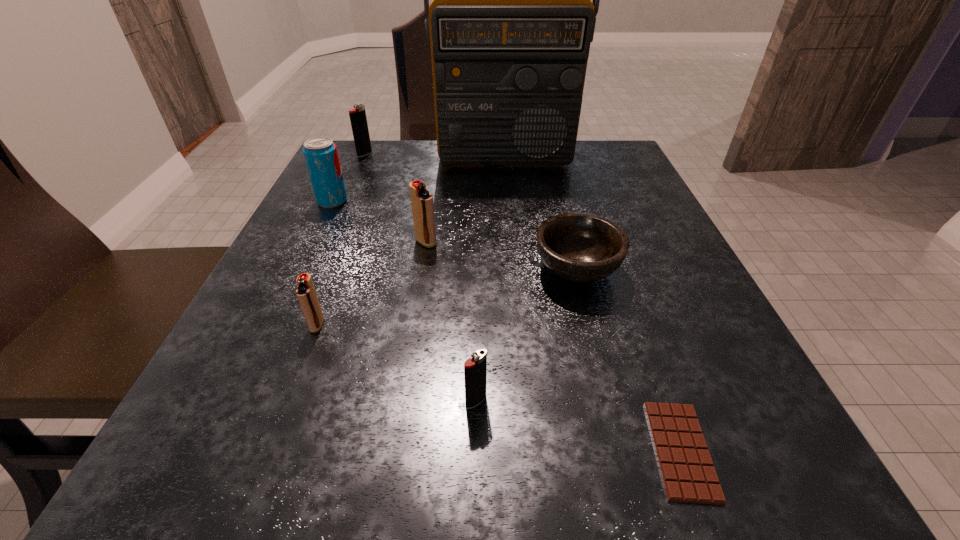
At what (x,y) coordinates should I click in order to perform the action: click on free location located on the left of the second shortest object. Please return your answer as a coordinate pair (x, y). Looking at the image, I should click on (312, 269).

What are the coordinates of `free point located on the left of the brown candy bar` in the screenshot? It's located at (431, 450).

Where is `radio receiver that is positioned at the far edge`? The image size is (960, 540). radio receiver that is positioned at the far edge is located at coordinates (511, 22).

Find the location of a particular element. This screenshot has height=540, width=960. igniter located in the far edge section of the desktop is located at coordinates (358, 119).

I want to click on object located at the near edge, so click(x=688, y=474).

Find the location of a particular element. The width and height of the screenshot is (960, 540). soda can located at the left edge is located at coordinates (320, 153).

You are a GUI agent. You are given a task and a screenshot of the screen. Output one action in this format:
    pyautogui.click(x=<x>, y=<y>)
    Task: Click on the radio receiver located in the right edge section of the desktop
    Image resolution: width=960 pixels, height=540 pixels.
    Given the screenshot: What is the action you would take?
    pyautogui.click(x=511, y=22)

In order to click on bowl present at the right edge in this screenshot , I will do `click(580, 247)`.

Find the location of `candy bar present at the right edge`. candy bar present at the right edge is located at coordinates (688, 474).

This screenshot has height=540, width=960. I want to click on object that is positioned at the far left corner, so click(358, 119).